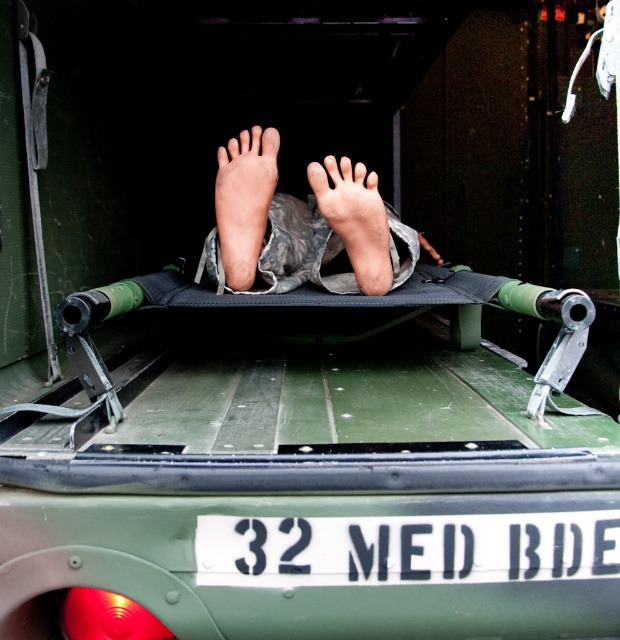
You are a military medic in the back of the vehicle and need to secure the white plastic license plate at center and the pale skin foot at center. Which object requires a wider securing strap?

The white plastic license plate at center requires a wider securing strap because its width is larger than the pale skin foot at center.

You are a medic in the field and need to assess the situation inside the military vehicle. You see a pale skin foot at center and a camouflage fabric foot at center. Which foot is higher up in the vehicle?

The pale skin foot at center is taller than the camouflage fabric foot at center, so the pale skin foot is higher up in the vehicle.

You are a military medic inside the vehicle and need to secure both the white plastic license plate at center and the pale skin foot at center. Which object requires a larger securing area?

The pale skin foot at center requires a larger securing area because it is larger than the white plastic license plate at center.